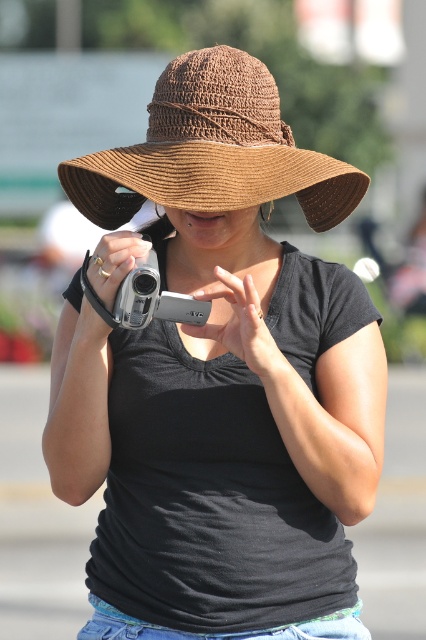
You are a photographer trying to capture a candid shot of the person in the scene. The person is holding the silver metallic camera at center and wearing the brown straw hat at center. Since the hat might block their face, can you estimate whether the hat is positioned in a way that could obscure their facial features?

The brown straw hat at center is located above the silver metallic camera at center, which means the hat is positioned over the person wearing it, likely obscuring their facial features from view.

In the scene shown: You are a photographer trying to capture a self portrait. You have a silver metallic camera at center and a brown straw hat at center. Can you hold both items close enough to take a selfie without moving your hands? Explain your reasoning.

The brown straw hat at center and silver metallic camera at center are 36.10 centimeters apart. Since the distance between them is about 36 centimeters, it may be challenging to hold both close enough for a selfie without adjusting your grip or moving your hands closer together.

You are a photographer trying to capture the perfect shot. You notice the brown straw hat at center and the silver metallic camera at center in your viewfinder. Which object is positioned to the right side of the other?

The brown straw hat at center is to the right of the silver metallic camera at center.